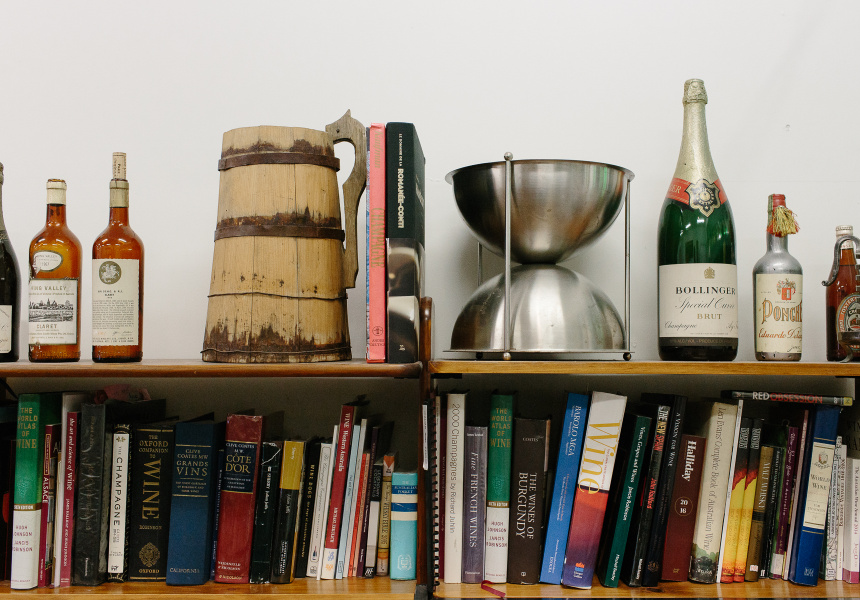
Find the location of a particular element. The height and width of the screenshot is (600, 860). top wooden shelf surface is located at coordinates (179, 368).